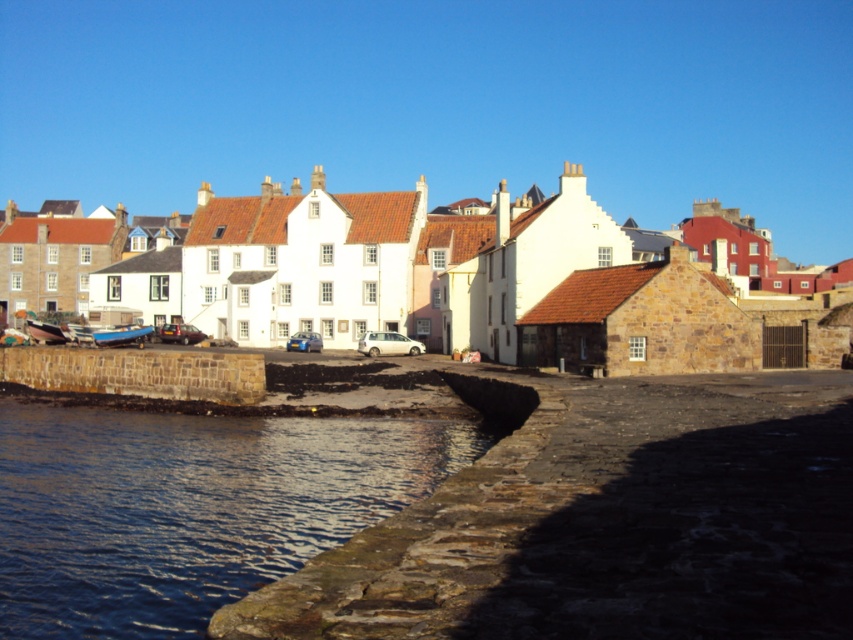
You are standing on the beach looking at the scene. Are the white stone houses at center located above or below the brown stone wall at lower left?

The white stone houses at center are positioned over the brown stone wall at lower left, meaning they are located above it.

You are a photographer planning to capture the entire row of white stone houses at center and the clear water at lower left in a single shot. Based on their widths, will you need to adjust your camera angle to ensure both fit horizontally in the frame?

The white stone houses at center might be wider than clear water at lower left, so adjusting the camera angle to accommodate their width would be advisable to ensure both fit in the frame.

You are standing at the edge of the stone embankment in the coastal village scene. You want to walk to the clear water at lower left without getting wet. The path leads past the white stone houses at center. Given that the distance between them is 38.43 meters, can you safely walk from the embankment to the water without stepping into the water?

The white stone houses at center is 38.43 meters away from the clear water at lower left, so yes, you can safely walk from the embankment to the clear water at lower left without stepping into the water since the path between them is 38.43 meters long.